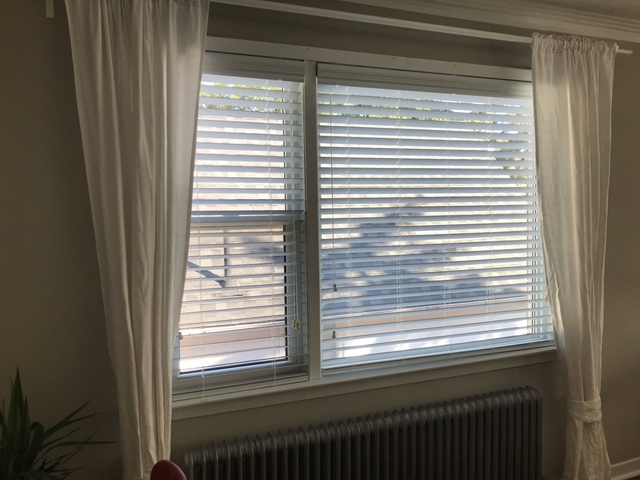
What are the coordinates of `trim where wall meets floor` in the screenshot? It's located at (630, 467).